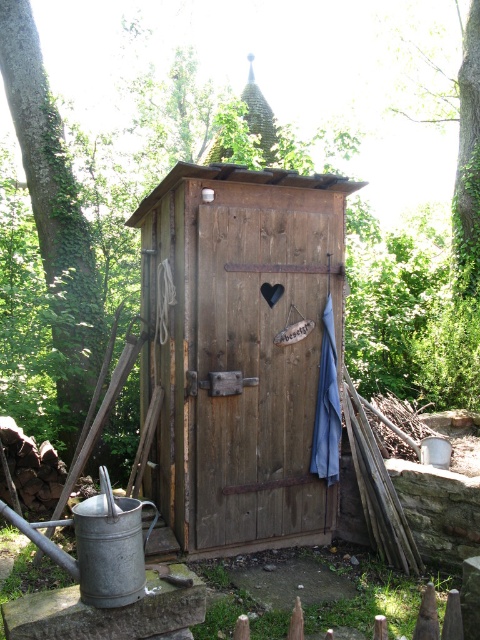
Question: Among these objects, which one is farthest from the camera?

Choices:
 (A) green leafy tree at left
 (B) wooden hut at center

Answer: (A)

Question: Which of the following is the closest to the observer?

Choices:
 (A) wooden hut at center
 (B) green leafy tree at left

Answer: (A)

Question: From the image, what is the correct spatial relationship of wooden hut at center in relation to green leafy tree at left?

Choices:
 (A) above
 (B) below

Answer: (B)

Question: Can you confirm if wooden hut at center is bigger than green leafy tree at left?

Choices:
 (A) no
 (B) yes

Answer: (B)

Question: Can you confirm if wooden hut at center is positioned to the left of green leafy tree at left?

Choices:
 (A) no
 (B) yes

Answer: (A)